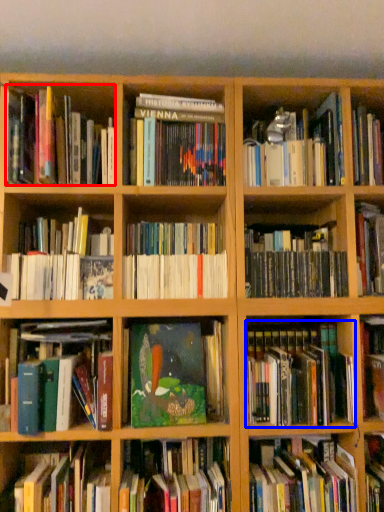
Question: Which of the following is the closest to the observer, book (highlighted by a red box) or book (highlighted by a blue box)?

Choices:
 (A) book
 (B) book

Answer: (A)